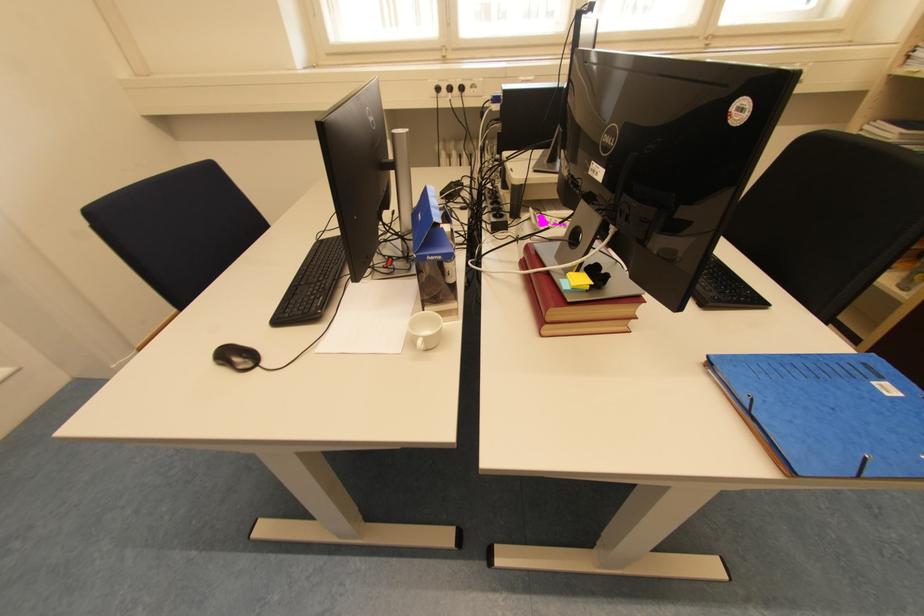
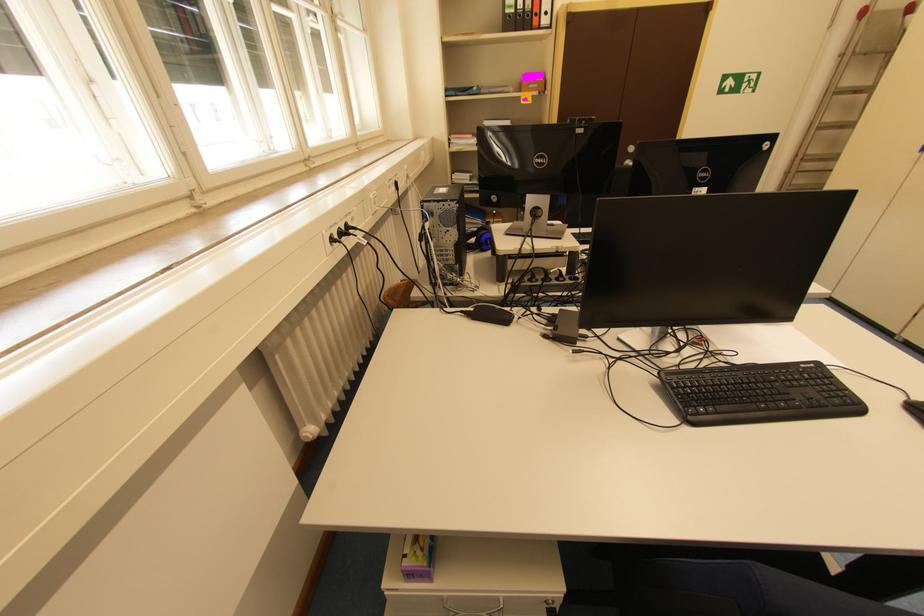
Find the pixel in the second image that matches pixel 268 365 in the first image.

(915, 400)